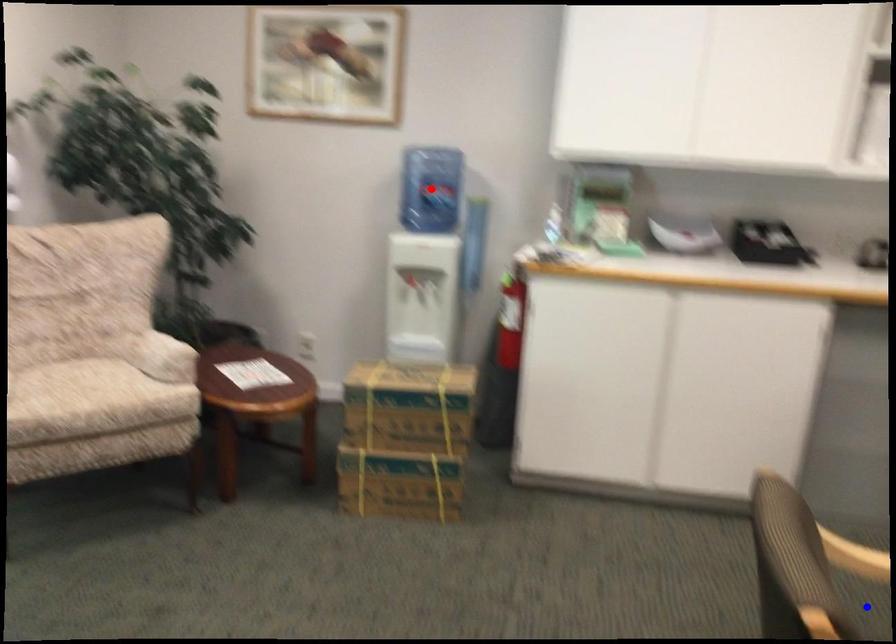
Question: In the image, two points are highlighted. Which point is nearer to the camera? Reply with the corresponding letter.

Choices:
 (A) blue point
 (B) red point

Answer: (A)